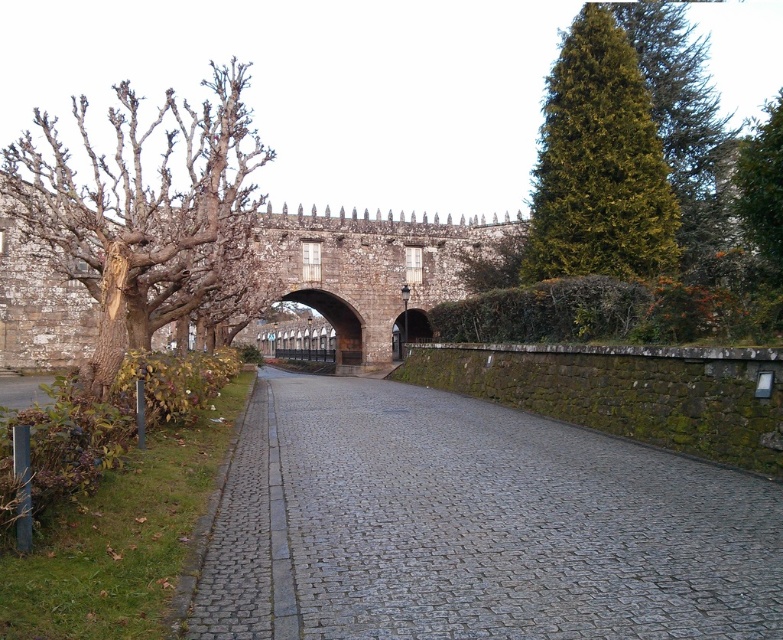
Is bare wood tree at left smaller than green textured tree at upper right?

Actually, bare wood tree at left might be larger than green textured tree at upper right.

From the picture: Can you confirm if bare wood tree at left is thinner than green textured tree at upper right?

No.

Between point (215, 173) and point (630, 227), which one is positioned behind?

The point (630, 227) is behind.

Where is `bare wood tree at left`? bare wood tree at left is located at coordinates (x=141, y=209).

Between green textured tree at upper right and green leafy tree at upper right, which one is positioned higher?

green leafy tree at upper right

Is green textured tree at upper right below green leafy tree at upper right?

A: Yes.

Between point (615, 84) and point (778, 252), which one is positioned in front?

Point (778, 252) is in front.

Find the location of a particular element. Image resolution: width=783 pixels, height=640 pixels. green textured tree at upper right is located at coordinates (599, 163).

Is gray cobblestone pavement at center smaller than green textured tree at upper right?

Correct, gray cobblestone pavement at center occupies less space than green textured tree at upper right.

Where is `gray cobblestone pavement at center`? gray cobblestone pavement at center is located at coordinates (474, 525).

What do you see at coordinates (474, 525) in the screenshot? The image size is (783, 640). I see `gray cobblestone pavement at center` at bounding box center [474, 525].

Where is `gray cobblestone pavement at center`? gray cobblestone pavement at center is located at coordinates (474, 525).